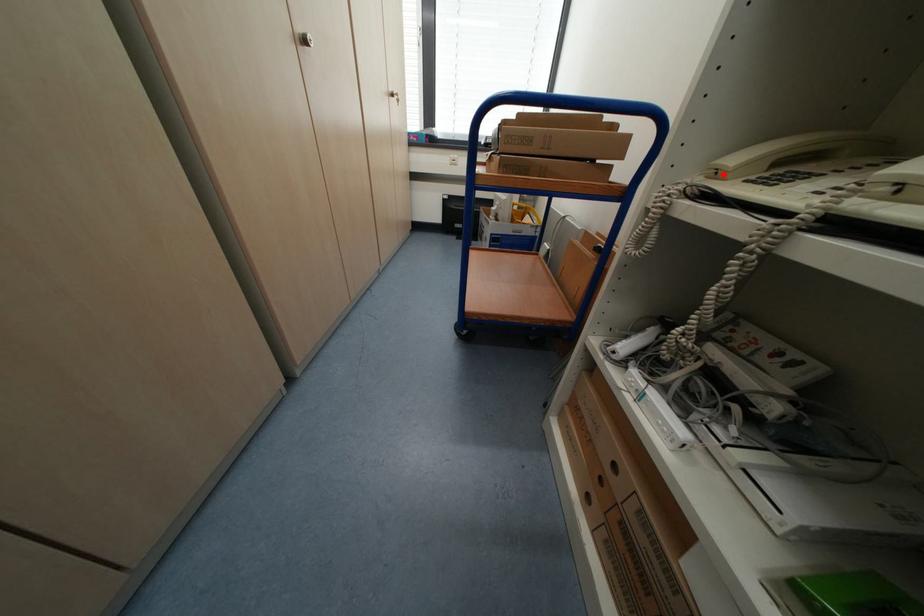
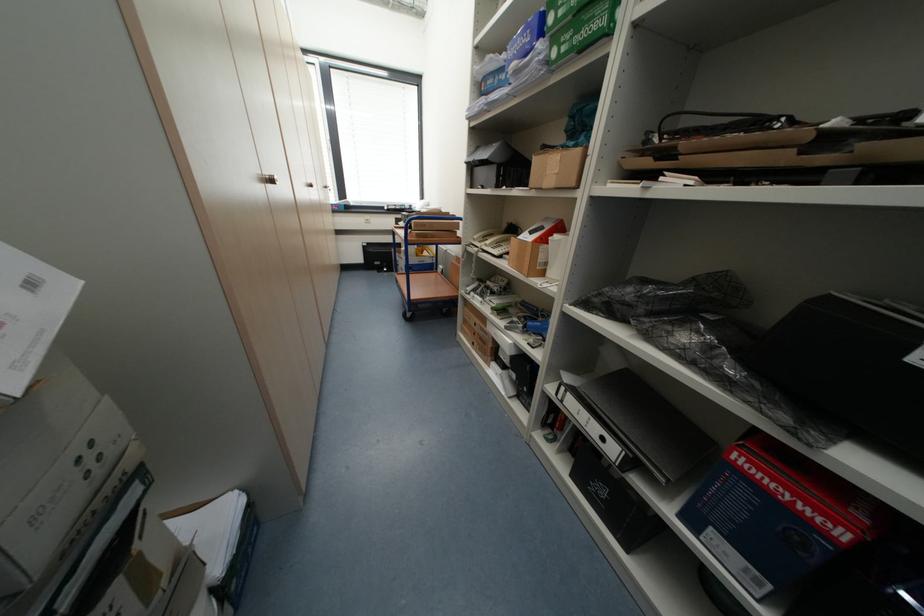
In the second image, find the point that corresponds to the highlighted location in the first image.

(480, 240)